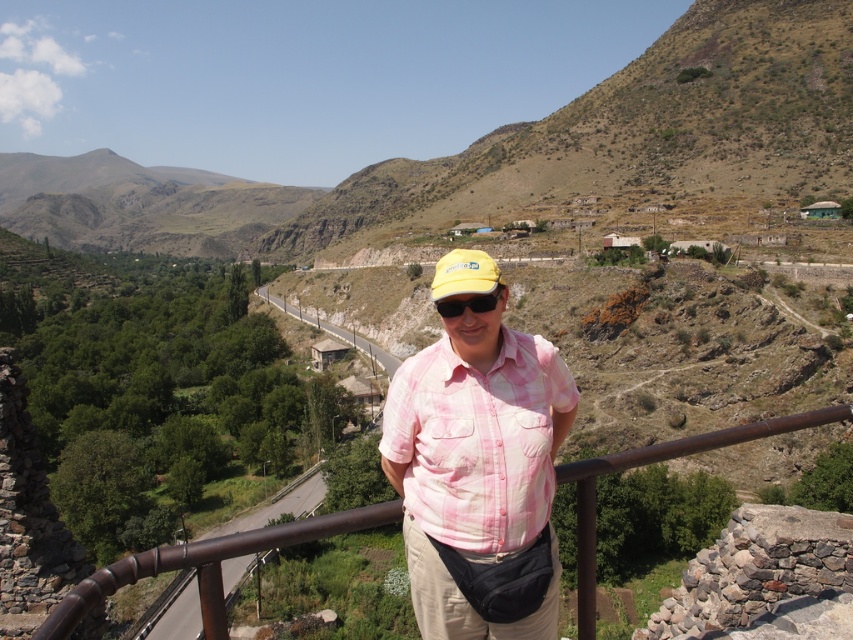
Question: In this image, where is asphalt road at lower left located relative to yellow fabric cap at center?

Choices:
 (A) left
 (B) right

Answer: (A)

Question: Can you confirm if pink plaid shirt at center is positioned below yellow matte sunglasses at center?

Choices:
 (A) yes
 (B) no

Answer: (A)

Question: Considering the real-world distances, which object is closest to the brown metal/rail at center?

Choices:
 (A) yellow matte sunglasses at center
 (B) yellow fabric cap at center
 (C) asphalt road at lower left
 (D) pink plaid shirt at center

Answer: (D)

Question: Which object appears farthest from the camera in this image?

Choices:
 (A) asphalt road at lower left
 (B) yellow matte sunglasses at center

Answer: (B)

Question: Which of the following is the closest to the observer?

Choices:
 (A) (387, 410)
 (B) (432, 292)
 (C) (498, 294)
 (D) (634, 449)

Answer: (C)

Question: Can you confirm if asphalt road at lower left is bigger than yellow matte sunglasses at center?

Choices:
 (A) yes
 (B) no

Answer: (A)